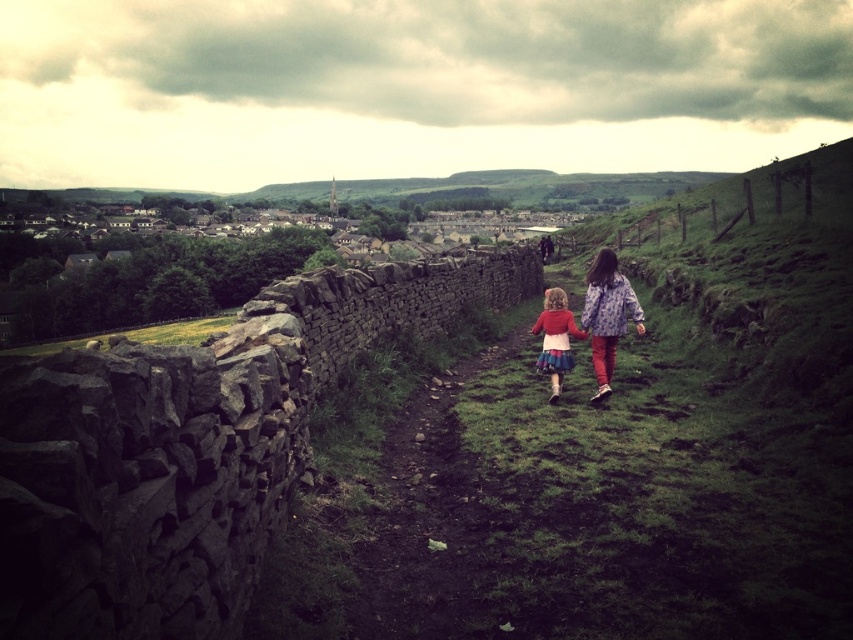
You are standing at the stone wall on the left side of the path and want to walk towards the village in the background. Which point, point (612, 339) or point (538, 316), would you reach first?

Point (612, 339) is closer to the viewer than point (538, 316), so you would reach point (612, 339) first.

You are a fashion designer observing the two children in the rural scene. The children are wearing the floral fabric jacket at right and the matte red sweater at center. Which child is wearing a garment that reaches higher up their body?

The floral fabric jacket at right is taller than the matte red sweater at center, so the child wearing the floral fabric jacket at right has a garment that reaches higher up their body.

You are a tailor observing two children in the rural scene. The children are wearing a floral fabric jacket at right and a matte red sweater at center. Which clothing item has a greater width?

The floral fabric jacket at right has a greater width than the matte red sweater at center.